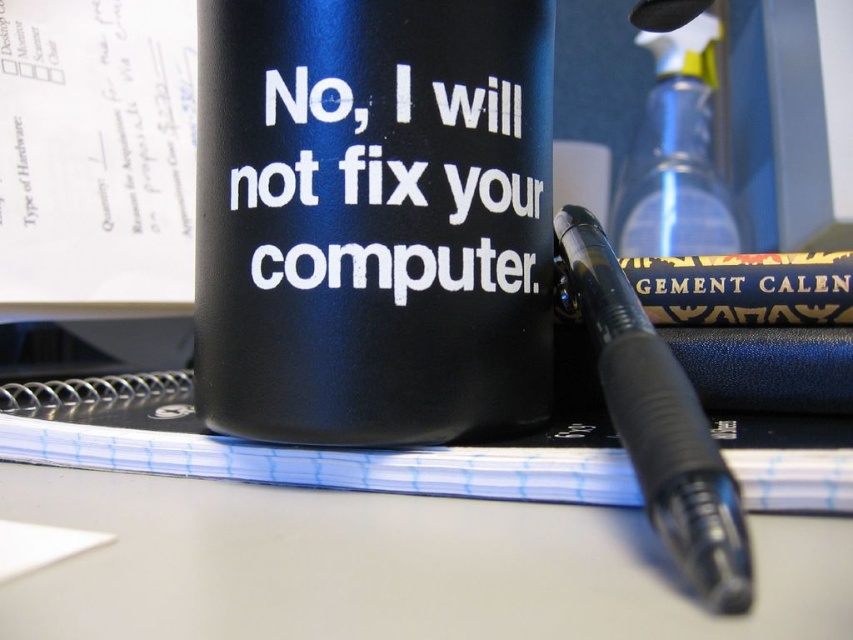
Is black matte mug at center below black matte text at center?

Correct, black matte mug at center is located below black matte text at center.

Between point (292, 404) and point (508, 96), which one is positioned in front?

Positioned in front is point (292, 404).

The width and height of the screenshot is (853, 640). Identify the location of black matte mug at center. (373, 218).

Is black matte mug at center to the left of black plastic pen at center from the viewer's perspective?

Yes, black matte mug at center is to the left of black plastic pen at center.

Can you confirm if black matte mug at center is shorter than black plastic pen at center?

In fact, black matte mug at center may be taller than black plastic pen at center.

Is point (270, 372) behind point (666, 429)?

Yes.

Locate an element on the screen. The height and width of the screenshot is (640, 853). black matte mug at center is located at coordinates (373, 218).

Is black plastic pen at center to the right of transparent plastic spray bottle at upper right from the viewer's perspective?

No, black plastic pen at center is not to the right of transparent plastic spray bottle at upper right.

Can you confirm if black plastic pen at center is positioned below transparent plastic spray bottle at upper right?

Correct, black plastic pen at center is located below transparent plastic spray bottle at upper right.

What are the coordinates of `black plastic pen at center` in the screenshot? It's located at (657, 420).